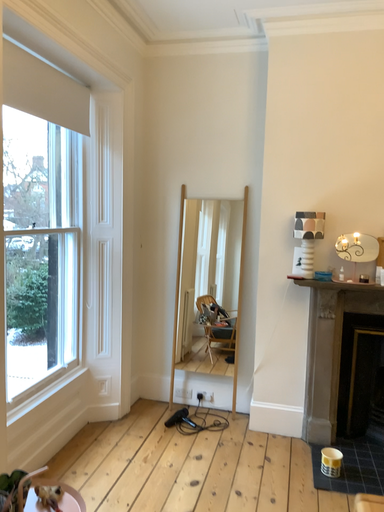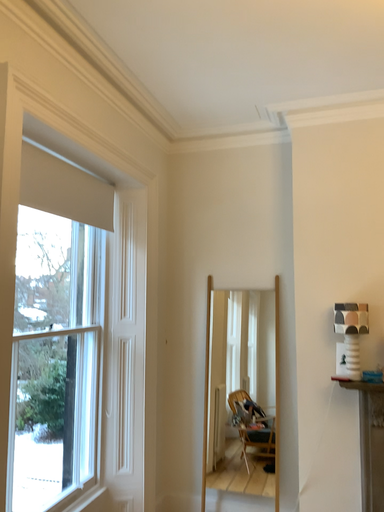
Question: How did the camera likely rotate when shooting the video?

Choices:
 (A) rotated upward
 (B) rotated downward

Answer: (A)